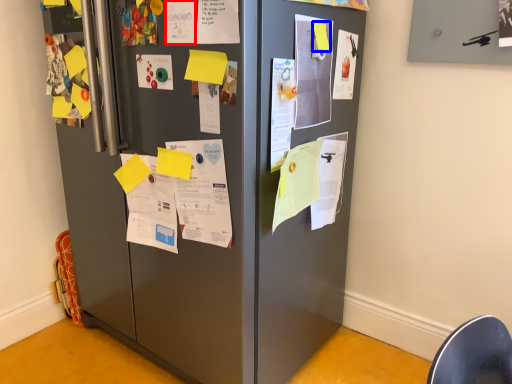
Question: Among these objects, which one is farthest to the camera, poster (highlighted by a red box) or note (highlighted by a blue box)?

Choices:
 (A) poster
 (B) note

Answer: (B)